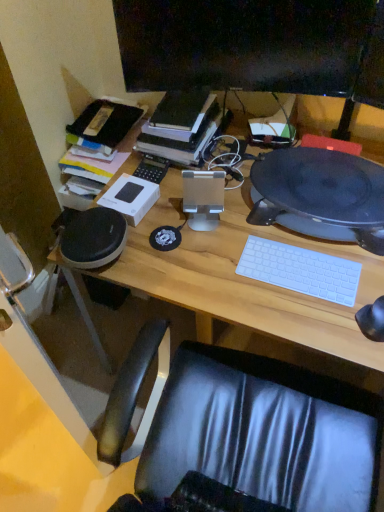
You are a GUI agent. You are given a task and a screenshot of the screen. Output one action in this format:
    pyautogui.click(x=<x>, y=<y>)
    Task: Click on the vacant space behind white matte keyboard at center
    
    Given the screenshot: What is the action you would take?
    pyautogui.click(x=277, y=230)